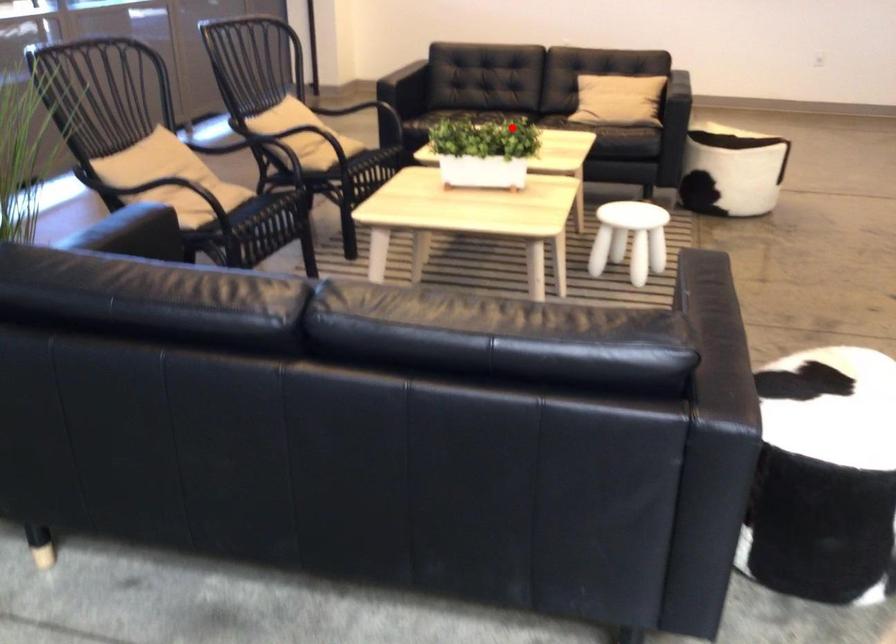
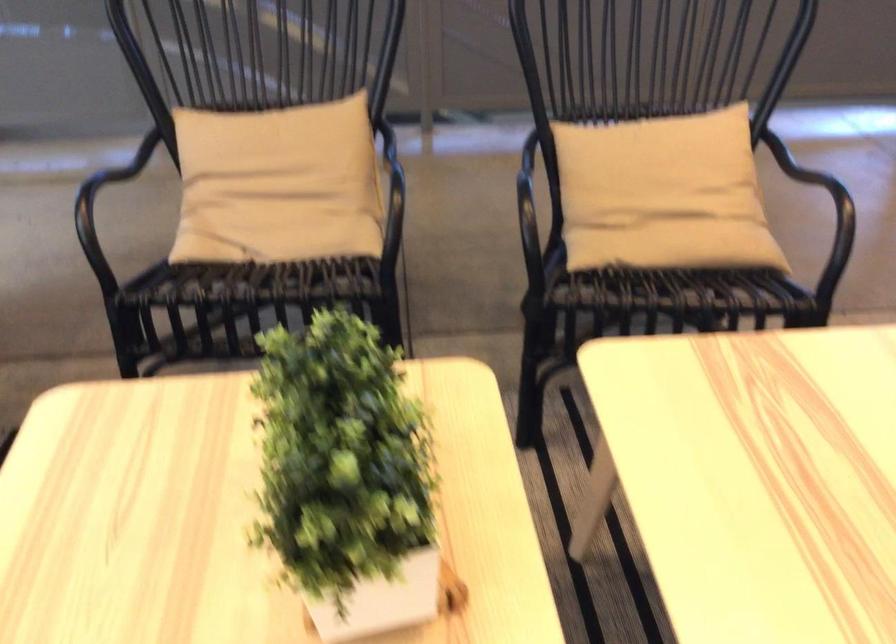
Find the pixel in the second image that matches the highlighted location in the first image.

(346, 477)